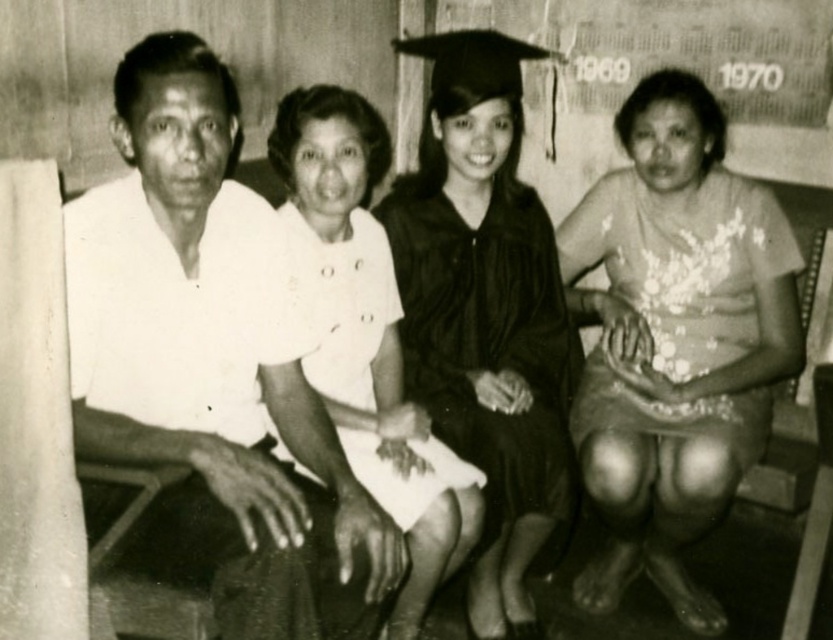
You are a photographer adjusting the camera height to capture both the matte black graduation gown at center and the white satin dress at center in the same frame. Which object should you position closer to the camera to ensure both are fully visible?

You should position the white satin dress at center closer to the camera since the matte black graduation gown at center is taller and will require more vertical space to capture fully.

You are a photographer adjusting the lighting in the room. You notice the white matte shirt at left and the white satin dress at center. Which object is closer to the bottom edge of the photo?

The white matte shirt at left is positioned under the white satin dress at center, so it is closer to the bottom edge of the photo.